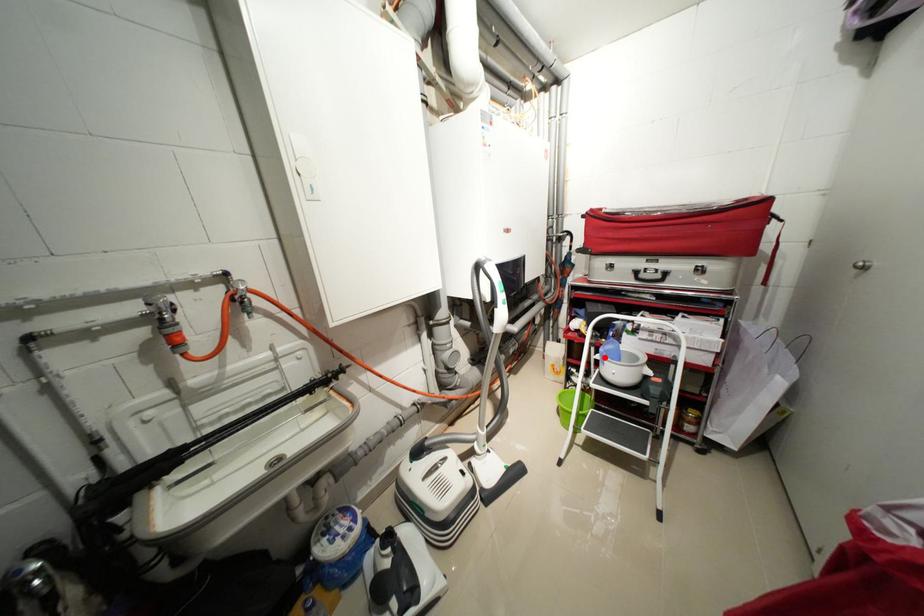
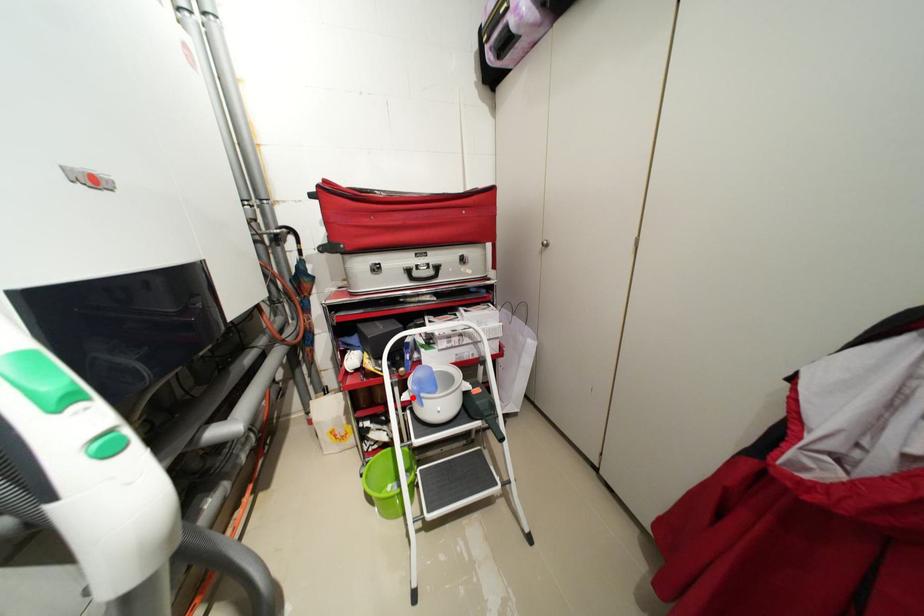
I am providing you with two images of the same scene from different viewpoints. A red point is marked on the first image and another point is marked on the second image. Are the points marked in image1 and image2 representing the same 3D position?

Yes